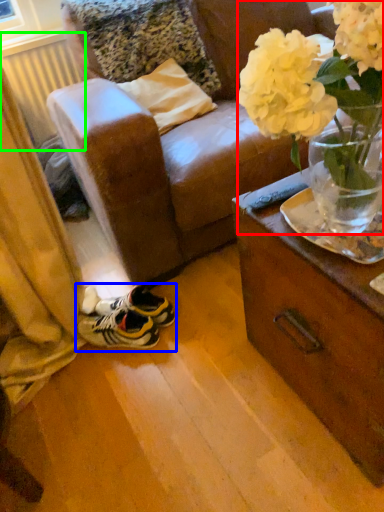
Question: Which object is positioned farthest from floral arrangement (highlighted by a red box)? Select from footwear (highlighted by a blue box) and radiator (highlighted by a green box).

Choices:
 (A) footwear
 (B) radiator

Answer: (B)